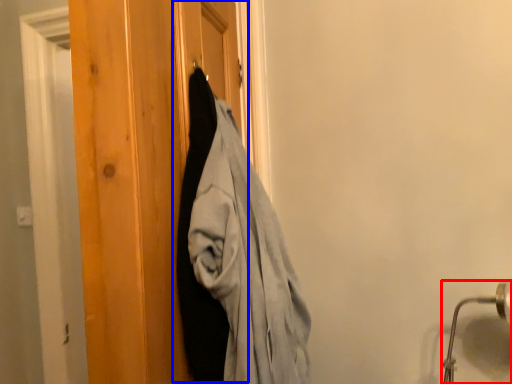
Question: Which of the following is the closest to the observer, door handle (highlighted by a red box) or barn door (highlighted by a blue box)?

Choices:
 (A) door handle
 (B) barn door

Answer: (B)